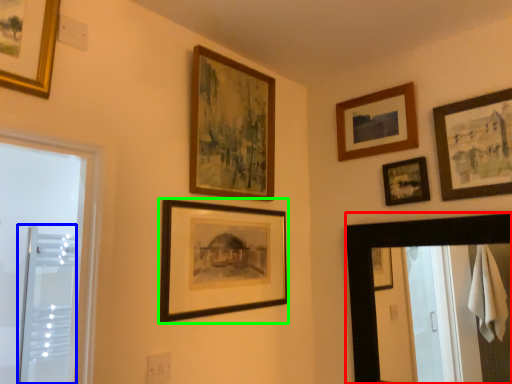
Question: Which object is the farthest from mirror (highlighted by a red box)? Choose among these: screen door (highlighted by a blue box) or picture frame (highlighted by a green box).

Choices:
 (A) screen door
 (B) picture frame

Answer: (A)